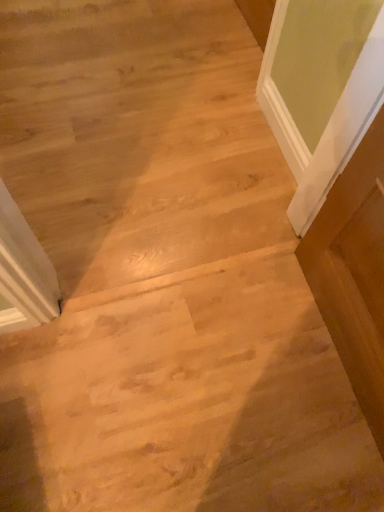
Locate an element on the screen. The image size is (384, 512). free space on the front side of wooden door at right is located at coordinates (303, 449).